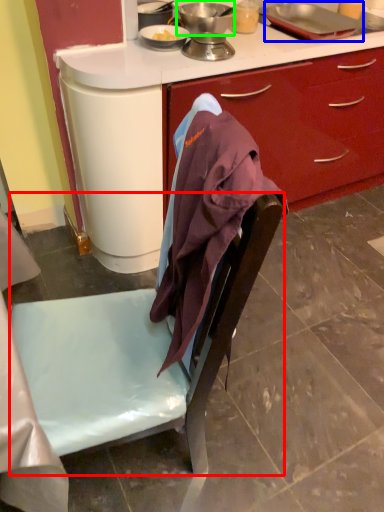
Question: Considering the real-world distances, which object is closest to chair (highlighted by a red box)? kitchen appliance (highlighted by a blue box) or kitchen appliance (highlighted by a green box).

Choices:
 (A) kitchen appliance
 (B) kitchen appliance

Answer: (B)